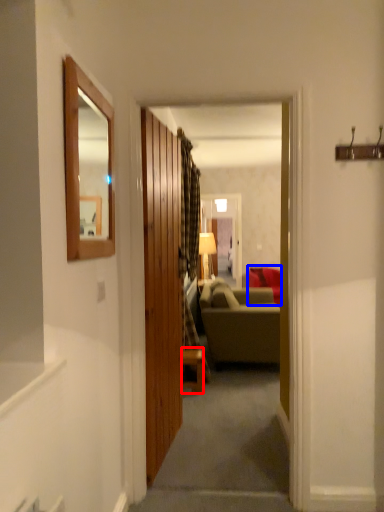
Question: Among these objects, which one is nearest to the camera, table (highlighted by a red box) or studio couch (highlighted by a blue box)?

Choices:
 (A) table
 (B) studio couch

Answer: (A)